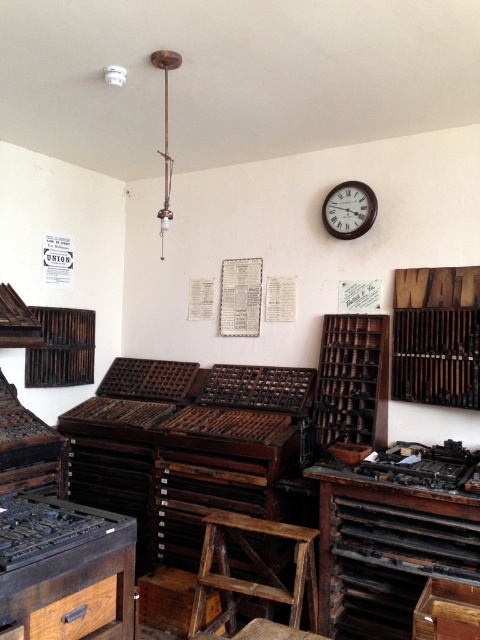
Question: Does dark wood workbench at lower right appear under dark brown wood stove at lower left?

Choices:
 (A) yes
 (B) no

Answer: (A)

Question: Observing the image, what is the correct spatial positioning of rustic wood stool at center in reference to dark brown wood stove at lower left?

Choices:
 (A) below
 (B) above

Answer: (A)

Question: Which object appears farthest from the camera in this image?

Choices:
 (A) dark brown wood stove at lower left
 (B) dark wood workbench at lower right
 (C) dark brown wood workbench at lower left
 (D) wooden clock at upper center

Answer: (D)

Question: Which point is farther to the camera?

Choices:
 (A) dark brown wood stove at lower left
 (B) dark brown wood workbench at lower left
 (C) wooden clock at upper center
 (D) dark wood workbench at lower right

Answer: (C)

Question: Does dark brown wood workbench at lower left appear on the right side of wooden clock at upper center?

Choices:
 (A) yes
 (B) no

Answer: (B)

Question: Estimate the real-world distances between objects in this image. Which object is farther from the wooden clock at upper center?

Choices:
 (A) dark brown wood stove at lower left
 (B) rustic wood stool at center
 (C) dark brown wood workbench at lower left

Answer: (C)